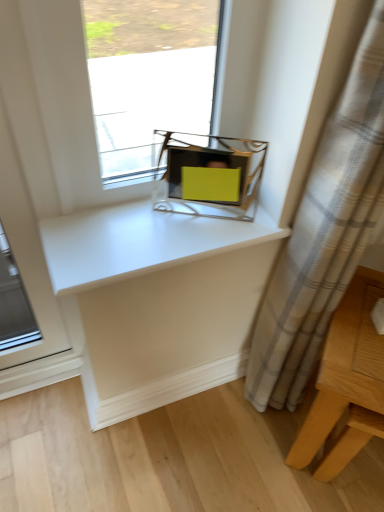
Find the location of a particular element. The height and width of the screenshot is (512, 384). vacant area that is in front of matte yellow plastic at center is located at coordinates (190, 236).